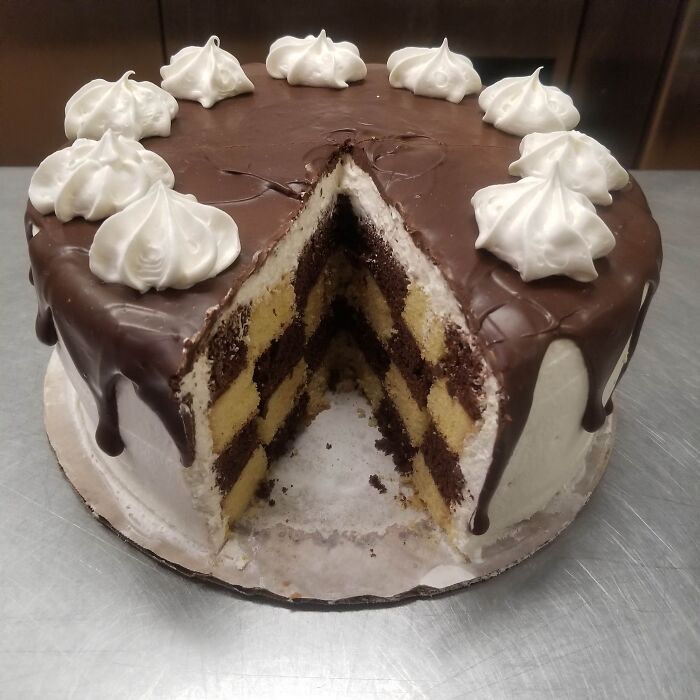
At what (x,y) coordinates should I click in order to perform the action: click on metal table. Please return your answer as a coordinate pair (x, y). Looking at the image, I should click on (224, 663).